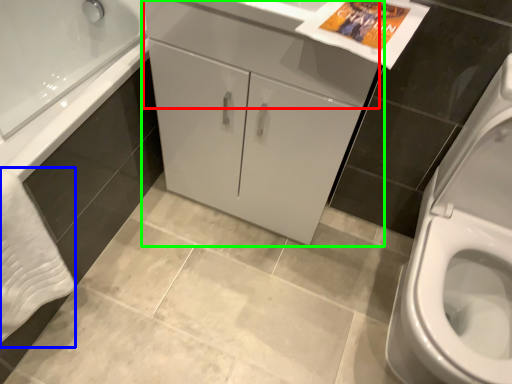
Question: Estimate the real-world distances between objects in this image. Which object is farther from drawer (highlighted by a red box), bath towel (highlighted by a blue box) or bathroom cabinet (highlighted by a green box)?

Choices:
 (A) bath towel
 (B) bathroom cabinet

Answer: (A)